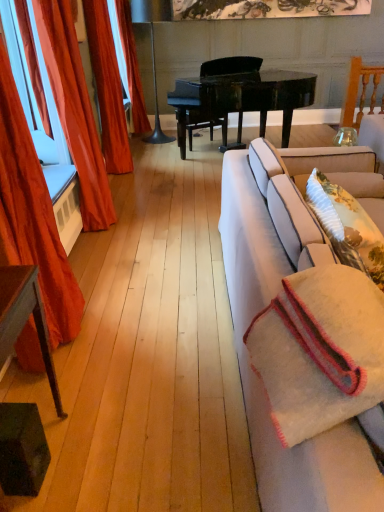
Question: Does white woven blanket at right lie in front of white fabric couch at right?

Choices:
 (A) no
 (B) yes

Answer: (A)

Question: From a real-world perspective, does white woven blanket at right sit lower than white fabric couch at right?

Choices:
 (A) no
 (B) yes

Answer: (A)

Question: Is white woven blanket at right oriented away from white fabric couch at right?

Choices:
 (A) yes
 (B) no

Answer: (A)

Question: Does white woven blanket at right have a greater width compared to white fabric couch at right?

Choices:
 (A) no
 (B) yes

Answer: (A)

Question: Does white woven blanket at right have a greater height compared to white fabric couch at right?

Choices:
 (A) no
 (B) yes

Answer: (A)

Question: Is velvet orange curtain at left, positioned as the fourth curtain in back-to-front order, inside the boundaries of white fabric couch at right, or outside?

Choices:
 (A) outside
 (B) inside

Answer: (A)

Question: In terms of width, does velvet orange curtain at left, positioned as the fourth curtain in back-to-front order, look wider or thinner when compared to white fabric couch at right?

Choices:
 (A) wide
 (B) thin

Answer: (B)

Question: Would you say velvet orange curtain at left, positioned as the fourth curtain in back-to-front order, is to the left or to the right of white fabric couch at right in the picture?

Choices:
 (A) left
 (B) right

Answer: (A)

Question: Is point (59, 322) positioned closer to the camera than point (309, 502)?

Choices:
 (A) closer
 (B) farther

Answer: (B)

Question: Does point (278, 394) appear closer or farther from the camera than point (18, 313)?

Choices:
 (A) farther
 (B) closer

Answer: (B)

Question: In terms of width, does white woven blanket at right look wider or thinner when compared to green painted wood side table at lower left?

Choices:
 (A) wide
 (B) thin

Answer: (A)

Question: Is white woven blanket at right bigger or smaller than green painted wood side table at lower left?

Choices:
 (A) small
 (B) big

Answer: (A)

Question: Is white woven blanket at right in front of or behind green painted wood side table at lower left in the image?

Choices:
 (A) front
 (B) behind

Answer: (A)

Question: From their relative heights in the image, would you say velvet orange curtain at left, which appears as the third curtain when viewed from the back, is taller or shorter than shiny orange curtain at left, arranged as the 2th curtain when viewed from the back?

Choices:
 (A) short
 (B) tall

Answer: (A)

Question: Considering the relative positions of velvet orange curtain at left, which appears as the third curtain when viewed from the back, and shiny orange curtain at left, marked as the third curtain in a front-to-back arrangement, in the image provided, is velvet orange curtain at left, which appears as the third curtain when viewed from the back, to the left or to the right of shiny orange curtain at left, marked as the third curtain in a front-to-back arrangement,?

Choices:
 (A) right
 (B) left

Answer: (A)